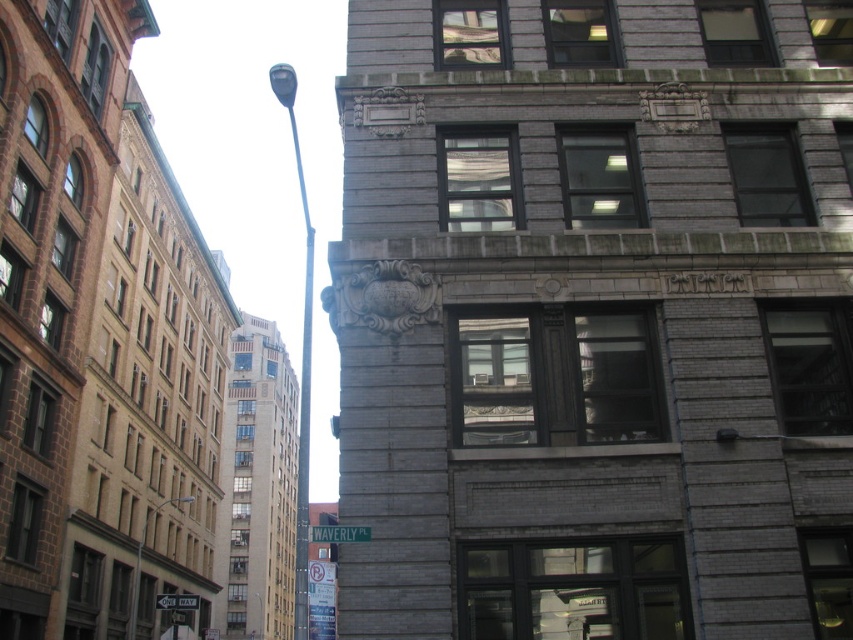
Based on the photo, which is more to the right, polished metal streetlight at center or metallic pole at center?

Positioned to the right is metallic pole at center.

From the picture: Can you confirm if polished metal streetlight at center is positioned to the left of metallic pole at center?

Indeed, polished metal streetlight at center is positioned on the left side of metallic pole at center.

The height and width of the screenshot is (640, 853). What do you see at coordinates (300, 358) in the screenshot?
I see `polished metal streetlight at center` at bounding box center [300, 358].

Locate an element on the screen. This screenshot has width=853, height=640. polished metal streetlight at center is located at coordinates (300, 358).

Does point (370, 534) lie in front of point (155, 600)?

Yes.

Does green metallic street sign at upper center have a lesser height compared to green plastic street sign at lower center?

Yes.

The width and height of the screenshot is (853, 640). What are the coordinates of `green metallic street sign at upper center` in the screenshot? It's located at (338, 532).

Does metallic pole at center have a lesser width compared to green plastic street sign at lower center?

Correct, metallic pole at center's width is less than green plastic street sign at lower center's.

Is metallic pole at center further to the viewer compared to green plastic street sign at lower center?

Yes, metallic pole at center is behind green plastic street sign at lower center.

The image size is (853, 640). I want to click on metallic pole at center, so click(x=141, y=557).